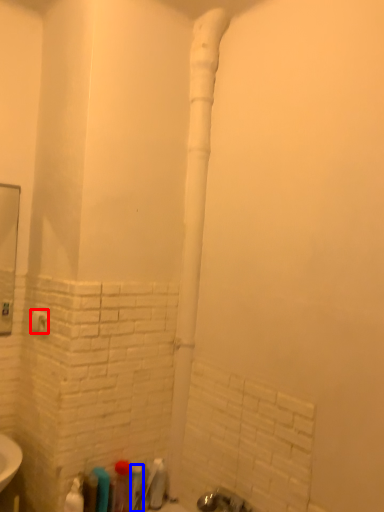
Question: Which point is further to the camera, towel bar (highlighted by a red box) or toiletry (highlighted by a blue box)?

Choices:
 (A) towel bar
 (B) toiletry

Answer: (A)